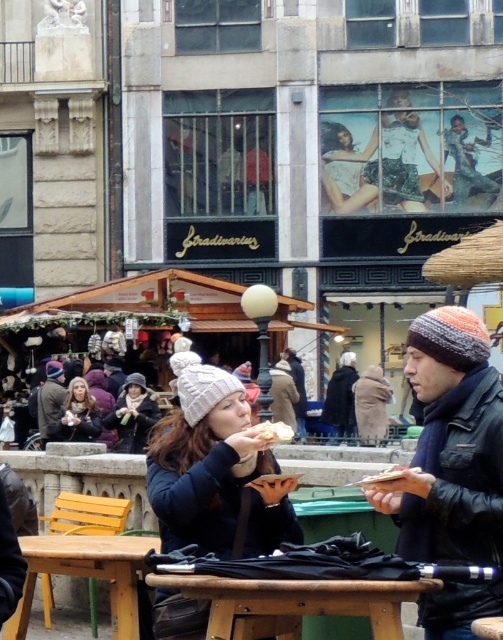
You are a vendor at the market and need to place both the matte gray beanie at left and the golden crumbly bread at center on a shelf. Which item should you place first if you want to ensure both items fit without rearranging?

You should place the matte gray beanie at left first because it has a greater height than the golden crumbly bread at center, so placing it first allows the shorter item to be placed on top or beside without needing to rearrange.

You are standing at the entrance of the market and see the white knit beanie at center. If you walk straight ahead, will you reach the beanie before the market stalls in the background?

The white knit beanie at center is located at point (215,472), which is closer to the foreground than the market stalls in the background. Therefore, walking straight ahead, you will reach the white knit beanie at center before the market stalls in the background.